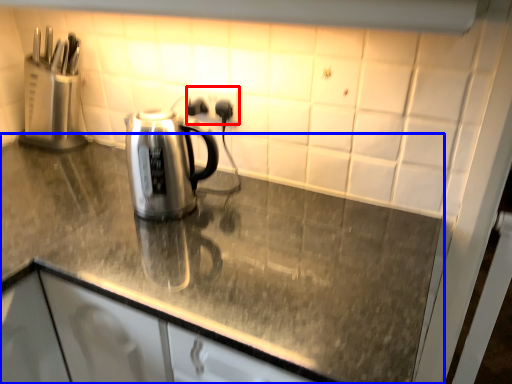
Question: Which of the following is the closest to the observer, electric outlet (highlighted by a red box) or countertop (highlighted by a blue box)?

Choices:
 (A) electric outlet
 (B) countertop

Answer: (B)